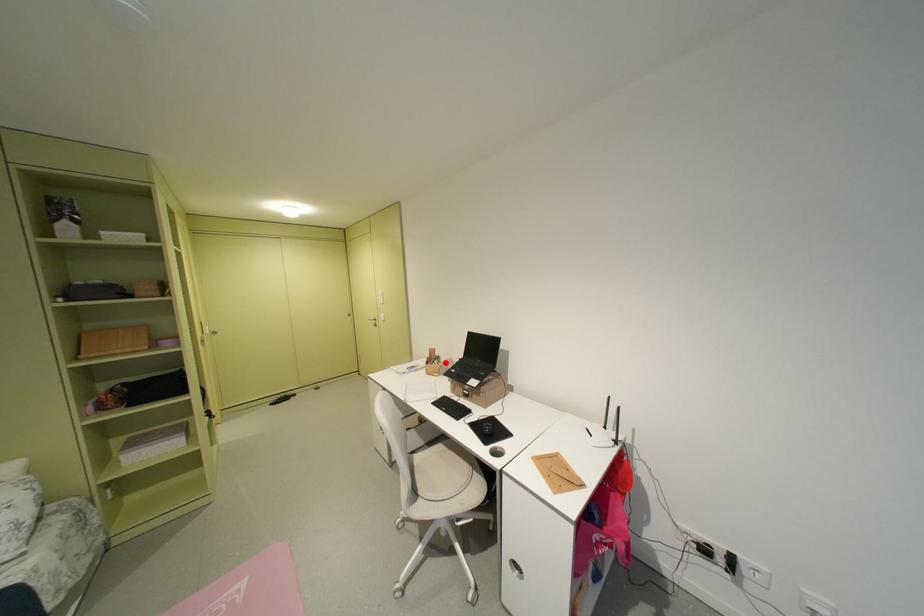
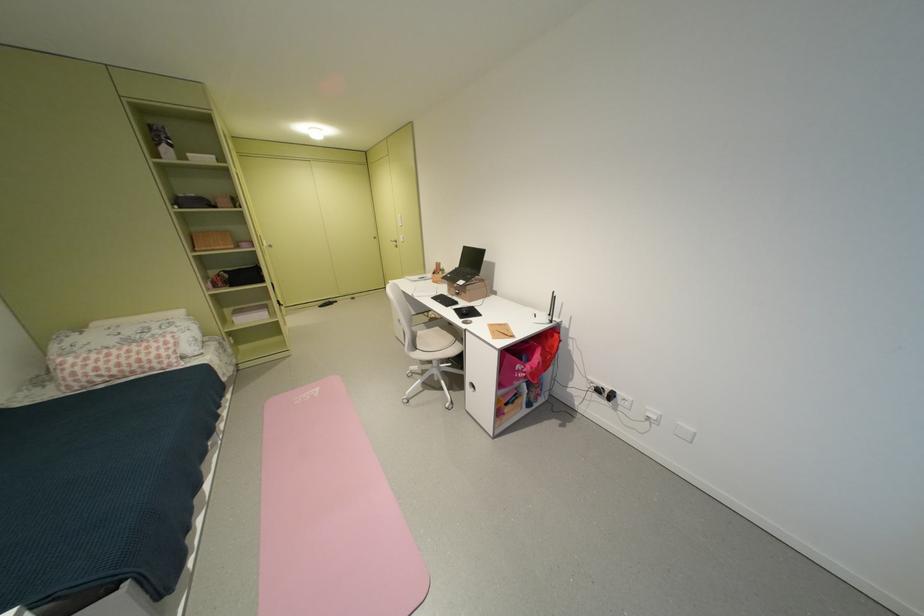
Where in the second image is the point corresponding to the highlighted location from the first image?

(450, 274)